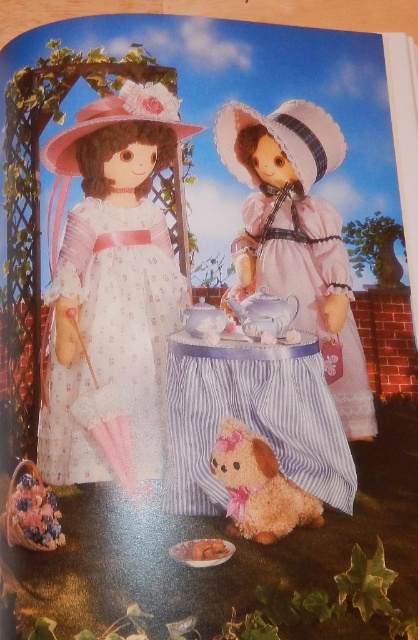
You are a guest at a tea party and see the matte white porcelain teapot at left and the fluffy beige plush dog at lower center. Which object is bigger?

The matte white porcelain teapot at left is larger in size than the fluffy beige plush dog at lower center.

You are a child playing with the dolls in the garden scene. You want to place the matte white porcelain teapot at left into the basket at the feet of the doll on the left. Can you do this without moving the brown plush toy at lower center?

The matte white porcelain teapot at left is positioned over the brown plush toy at lower center, so you cannot place the teapot into the basket without moving the plush toy first.